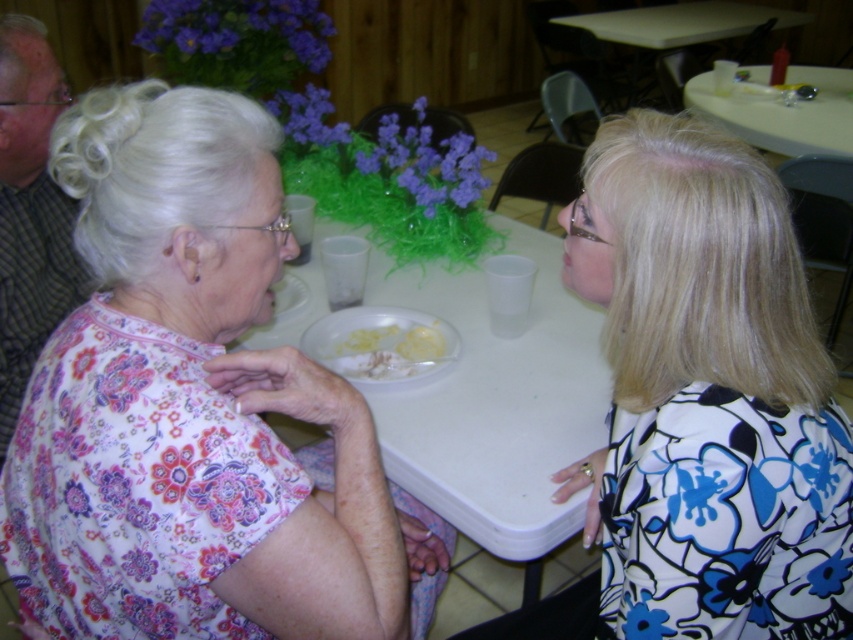
Question: Which object appears closest to the camera in this image?

Choices:
 (A) white floral dress at center
 (B) white creamy food at center
 (C) white plastic table at upper right
 (D) floral-patterned blouse at left

Answer: (D)

Question: Which object is the closest to the gray striped shirt at left?

Choices:
 (A) white plastic table at center
 (B) floral-patterned blouse at left

Answer: (A)

Question: Is white floral dress at center further to the viewer compared to white plastic table at upper right?

Choices:
 (A) no
 (B) yes

Answer: (A)

Question: Can you confirm if white floral dress at center is positioned to the left of white creamy food at center?

Choices:
 (A) yes
 (B) no

Answer: (B)

Question: Does white plastic table at center have a larger size compared to white plastic table at upper right?

Choices:
 (A) no
 (B) yes

Answer: (A)

Question: Which object is the farthest from the white floral dress at center?

Choices:
 (A) white plastic table at upper right
 (B) floral-patterned blouse at left
 (C) gray striped shirt at left

Answer: (A)